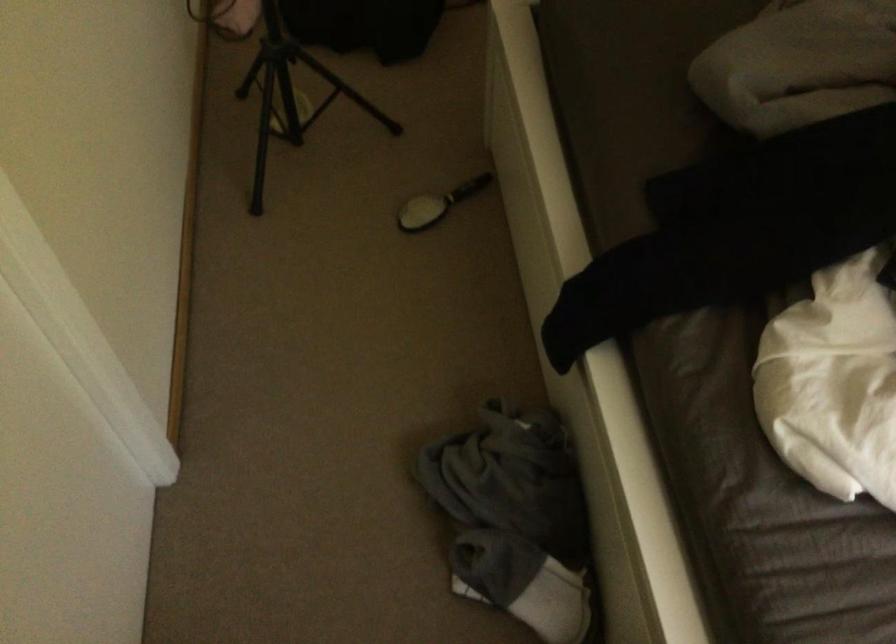
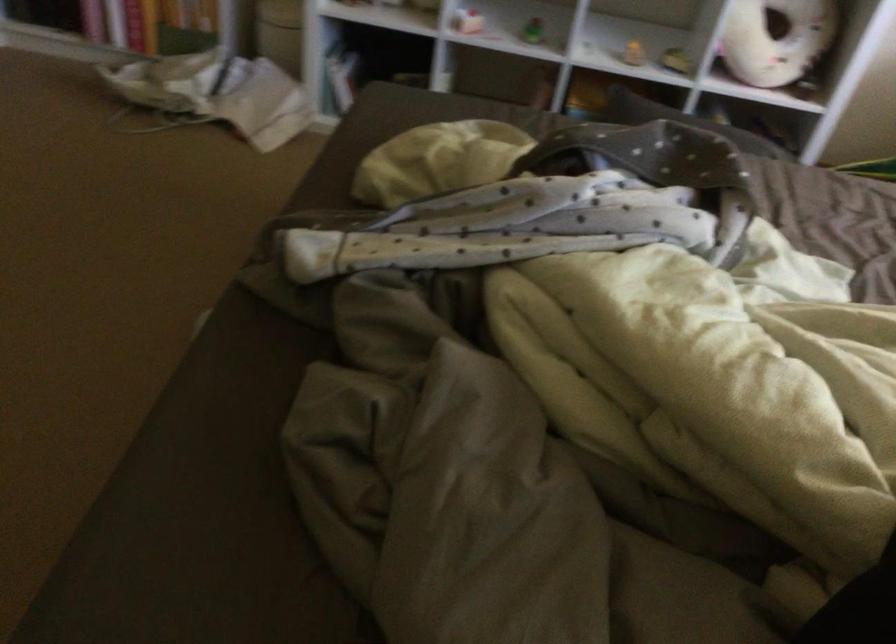
Question: The camera is either moving clockwise (left) or counter-clockwise (right) around the object. The first image is from the beginning of the video and the second image is from the end. Is the camera moving left or right when shooting the video?

Choices:
 (A) Left
 (B) Right

Answer: (A)